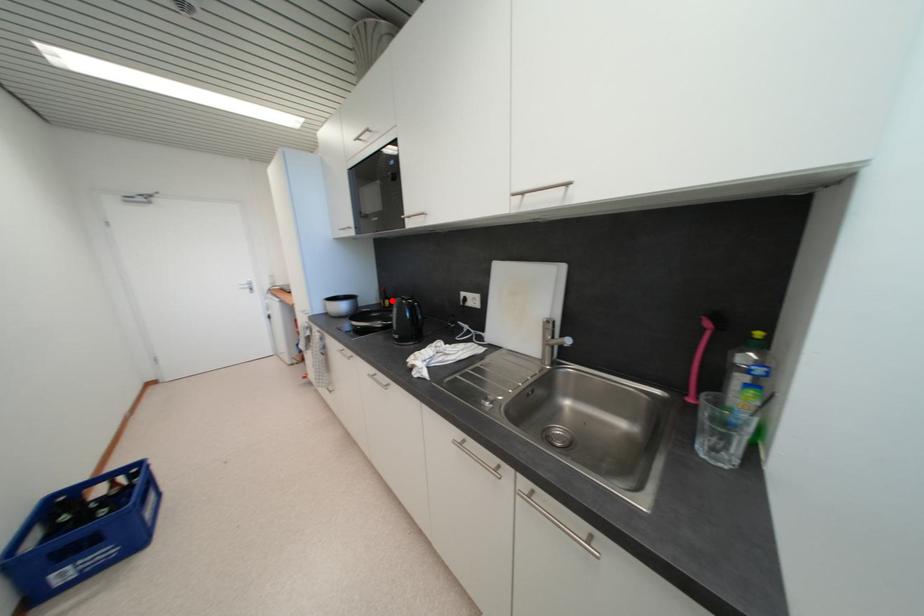
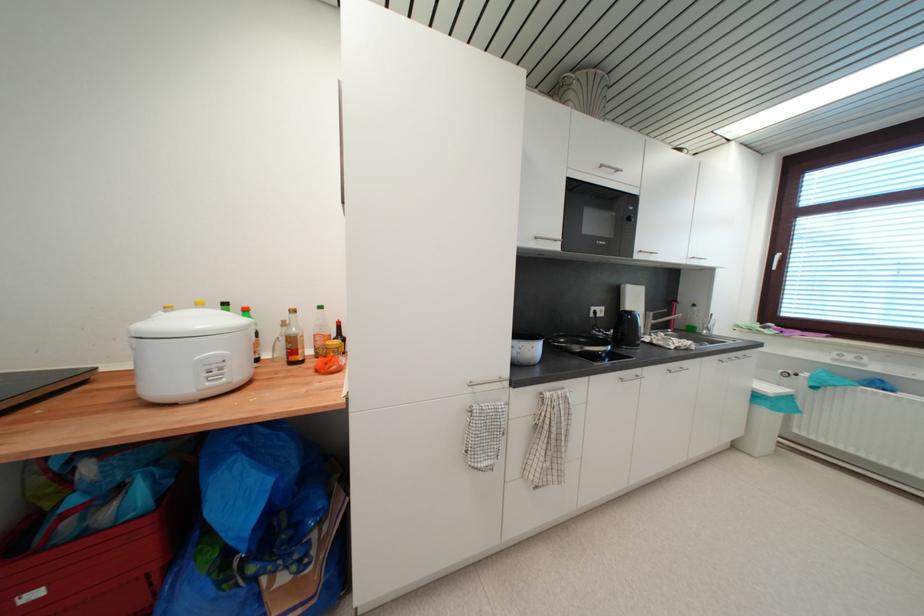
Question: I am providing you with two images of the same scene from different viewpoints. A red point is marked on the first image. Is the red point's position out of view in image 2?

Choices:
 (A) Yes
 (B) No

Answer: (A)